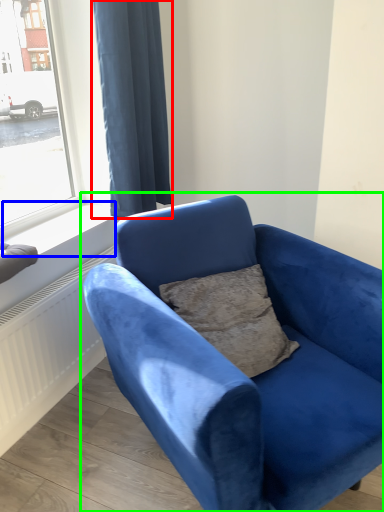
Question: Based on their relative distances, which object is farther from curtain (highlighted by a red box)? Choose from window sill (highlighted by a blue box) and studio couch (highlighted by a green box).

Choices:
 (A) window sill
 (B) studio couch

Answer: (B)